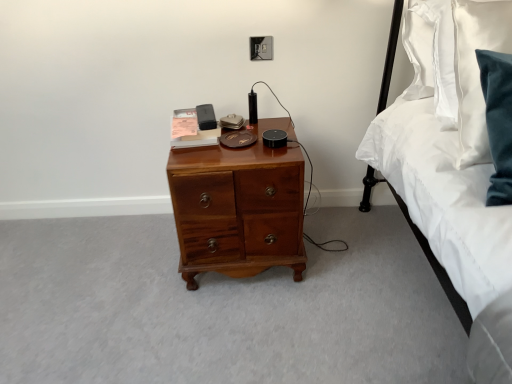
Question: Which direction should I rotate to look at black plastic electric outlet at upper center?

Choices:
 (A) right
 (B) left

Answer: (A)

Question: Is shiny brown wooden chest of drawers at center positioned behind white satin bed at right?

Choices:
 (A) yes
 (B) no

Answer: (A)

Question: Does shiny brown wooden chest of drawers at center have a smaller size compared to white satin bed at right?

Choices:
 (A) yes
 (B) no

Answer: (A)

Question: Considering the relative sizes of shiny brown wooden chest of drawers at center and white satin bed at right in the image provided, is shiny brown wooden chest of drawers at center thinner than white satin bed at right?

Choices:
 (A) no
 (B) yes

Answer: (B)

Question: Is shiny brown wooden chest of drawers at center completely or partially outside of white satin bed at right?

Choices:
 (A) no
 (B) yes

Answer: (B)

Question: Are shiny brown wooden chest of drawers at center and white satin bed at right making contact?

Choices:
 (A) no
 (B) yes

Answer: (A)

Question: Does shiny brown wooden chest of drawers at center appear on the right side of white satin bed at right?

Choices:
 (A) yes
 (B) no

Answer: (B)

Question: Is white satin bed at right positioned with its back to shiny brown wooden chest of drawers at center?

Choices:
 (A) no
 (B) yes

Answer: (A)

Question: Is shiny brown wooden chest of drawers at center completely or partially inside white satin bed at right?

Choices:
 (A) no
 (B) yes

Answer: (A)

Question: Is white satin bed at right facing towards shiny brown wooden chest of drawers at center?

Choices:
 (A) yes
 (B) no

Answer: (B)

Question: Is white satin bed at right further to the viewer compared to shiny brown wooden chest of drawers at center?

Choices:
 (A) no
 (B) yes

Answer: (A)

Question: Is white satin bed at right outside of shiny brown wooden chest of drawers at center?

Choices:
 (A) yes
 (B) no

Answer: (A)

Question: Does white satin bed at right touch shiny brown wooden chest of drawers at center?

Choices:
 (A) no
 (B) yes

Answer: (A)

Question: Is shiny brown wooden chest of drawers at center at the right side of black plastic electric outlet at upper center?

Choices:
 (A) no
 (B) yes

Answer: (A)